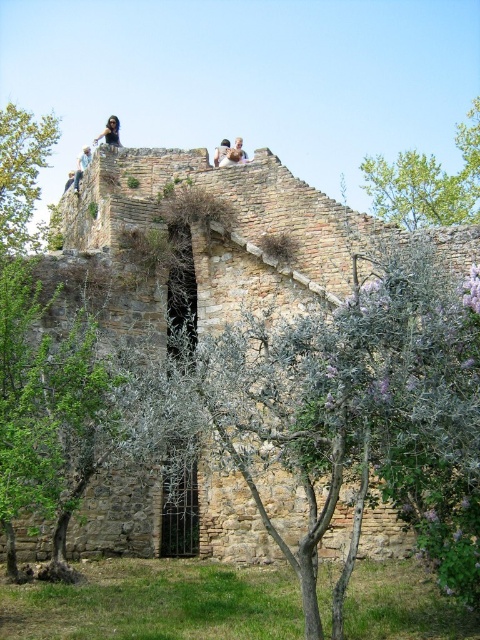
You are a photographer trying to capture a clear shot of the two people at the ancient stone structure. The dark brown leather jacket at upper center and the dark brown hair at upper center are both in your frame. Which object should you focus on if you want to prioritize the one that is taller?

The dark brown leather jacket at upper center has a greater height compared to the dark brown hair at upper center, so you should focus on the dark brown leather jacket at upper center to prioritize the taller object.

You are standing at the base of the ancient stone structure and want to take a photo of the blonde hair person at upper center without including the green leafy tree at upper left in the frame. Which direction should you move to achieve this?

Move to the right side of the structure so that the green leafy tree at upper left is out of the frame while keeping the blonde hair person at upper center in view.

You are standing at the ancient stone structure and want to take a photo. There are two points marked in the image at coordinates point (81, 170) and point (64, 188). Which point is closer to you?

Point (81, 170) is closer to the viewer than point (64, 188).